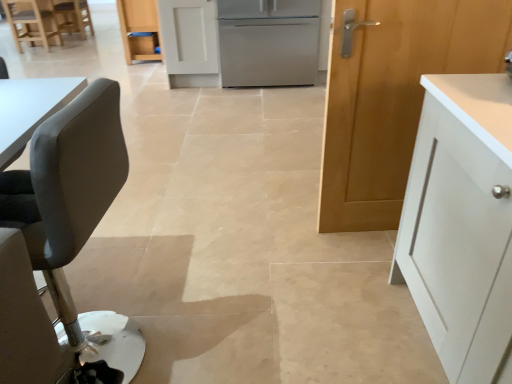
In order to face matte gray chair at left, marked as the 3th chair in a left-to-right arrangement, should I rotate leftwards or rightwards?

Rotate left and turn 25.815 degrees.

Measure the distance between matte gray chair at left, arranged as the third chair when viewed from the back, and camera.

matte gray chair at left, arranged as the third chair when viewed from the back, is 24.71 inches from camera.

Describe the element at coordinates (268, 42) in the screenshot. I see `stainless steel refrigerator at center` at that location.

I want to click on wooden door at right, which is the first cabinetry in right-to-left order, so 394,96.

Where is `matte wood cabinet at center, which is the 2th cabinetry from front to back`? This screenshot has height=384, width=512. matte wood cabinet at center, which is the 2th cabinetry from front to back is located at coordinates (139, 29).

From the picture: Measure the distance between matte gray chair at upper left, placed as the 1th chair when sorted from left to right, and camera.

A distance of 5.20 meters exists between matte gray chair at upper left, placed as the 1th chair when sorted from left to right, and camera.

At what (x,y) coordinates should I click in order to perform the action: click on matte gray chair at left, marked as the 3th chair in a left-to-right arrangement. Please return your answer as a coordinate pair (x, y). The width and height of the screenshot is (512, 384). Looking at the image, I should click on (65, 246).

Is wooden chair at upper left, the third chair when ordered from front to back, to the left or to the right of matte gray chair at upper left, the third chair when ordered from right to left, in the image?

wooden chair at upper left, the third chair when ordered from front to back, is to the right of matte gray chair at upper left, the third chair when ordered from right to left.

From a real-world perspective, is wooden chair at upper left, acting as the 2th chair starting from the right, on top of matte gray chair at upper left, positioned as the 2th chair in top-to-bottom order?

No.

In the scene shown: From the image's perspective, which is above, wooden chair at upper left, the second chair positioned from the left, or matte gray chair at upper left, which appears as the 2th chair when viewed from the back?

wooden chair at upper left, the second chair positioned from the left, is shown above in the image.

Which of these two, wooden chair at upper left, marked as the 3th chair in a bottom-to-top arrangement, or matte gray chair at upper left, marked as the second chair in a front-to-back arrangement, is thinner?

wooden chair at upper left, marked as the 3th chair in a bottom-to-top arrangement.

Is stainless steel refrigerator at center bigger than matte gray chair at upper left, marked as the second chair in a bottom-to-top arrangement?

Correct, stainless steel refrigerator at center is larger in size than matte gray chair at upper left, marked as the second chair in a bottom-to-top arrangement.

Would you say stainless steel refrigerator at center is outside matte gray chair at upper left, positioned as the 2th chair in top-to-bottom order?

Absolutely, stainless steel refrigerator at center is external to matte gray chair at upper left, positioned as the 2th chair in top-to-bottom order.

Considering their positions, is matte gray chair at left, arranged as the third chair when viewed from the back, located in front of or behind wooden door at right, which appears as the 2th cabinetry when viewed from the top?

matte gray chair at left, arranged as the third chair when viewed from the back, is positioned closer to the viewer than wooden door at right, which appears as the 2th cabinetry when viewed from the top.

Considering the sizes of objects matte gray chair at left, marked as the 3th chair in a left-to-right arrangement, and wooden door at right, placed as the first cabinetry when sorted from front to back, in the image provided, who is shorter, matte gray chair at left, marked as the 3th chair in a left-to-right arrangement, or wooden door at right, placed as the first cabinetry when sorted from front to back,?

matte gray chair at left, marked as the 3th chair in a left-to-right arrangement.

What's the angular difference between matte gray chair at left, arranged as the third chair when viewed from the back, and wooden door at right, which appears as the 2th cabinetry when viewed from the top,'s facing directions?

The angle between the facing direction of matte gray chair at left, arranged as the third chair when viewed from the back, and the facing direction of wooden door at right, which appears as the 2th cabinetry when viewed from the top, is 88.2 degrees.

Can you tell me how much wooden door at right, which ranks as the 2th cabinetry in back-to-front order, and matte gray chair at left, arranged as the third chair when viewed from the back, differ in facing direction?

88.2 degrees.

From a real-world perspective, who is located lower, wooden door at right, which ranks as the 2th cabinetry in back-to-front order, or matte gray chair at left, the third chair positioned from the top?

From a 3D spatial view, matte gray chair at left, the third chair positioned from the top, is below.

At what (x,y) coordinates should I click in order to perform the action: click on chair below the wooden door at right, which ranks as the 2th cabinetry in back-to-front order (from the image's perspective). Please return your answer as a coordinate pair (x, y). Looking at the image, I should click on (65, 246).

Is wooden door at right, the 2th cabinetry viewed from the left, shorter than matte gray chair at left, marked as the first chair in a front-to-back arrangement?

Incorrect, the height of wooden door at right, the 2th cabinetry viewed from the left, does not fall short of that of matte gray chair at left, marked as the first chair in a front-to-back arrangement.

Between stainless steel refrigerator at center and wooden chair at upper left, which appears as the 1th chair when viewed from the back, which one has smaller size?

Smaller between the two is wooden chair at upper left, which appears as the 1th chair when viewed from the back.

From the picture: Can you tell me how much stainless steel refrigerator at center and wooden chair at upper left, the third chair when ordered from front to back, differ in facing direction?

They differ by 89.3 degrees in their facing directions.

Does stainless steel refrigerator at center contain wooden chair at upper left, which appears as the 1th chair when viewed from the back?

No, wooden chair at upper left, which appears as the 1th chair when viewed from the back, is located outside of stainless steel refrigerator at center.

Considering the relative sizes of stainless steel refrigerator at center and wooden chair at upper left, marked as the 3th chair in a bottom-to-top arrangement, in the image provided, is stainless steel refrigerator at center wider than wooden chair at upper left, marked as the 3th chair in a bottom-to-top arrangement,?

Indeed, stainless steel refrigerator at center has a greater width compared to wooden chair at upper left, marked as the 3th chair in a bottom-to-top arrangement.

Between point (121, 15) and point (260, 18), which one is positioned behind?

Positioned behind is point (121, 15).

How far apart are matte wood cabinet at center, arranged as the 1th cabinetry when viewed from the top, and stainless steel refrigerator at center?

A distance of 2.01 meters exists between matte wood cabinet at center, arranged as the 1th cabinetry when viewed from the top, and stainless steel refrigerator at center.

Is matte wood cabinet at center, arranged as the 1th cabinetry when viewed from the top, facing away from stainless steel refrigerator at center?

No.

From their relative heights in the image, would you say matte wood cabinet at center, which appears as the 1th cabinetry when viewed from the back, is taller or shorter than stainless steel refrigerator at center?

matte wood cabinet at center, which appears as the 1th cabinetry when viewed from the back, is shorter than stainless steel refrigerator at center.

Is wooden door at right, which ranks as the 2th cabinetry in back-to-front order, taller or shorter than matte wood cabinet at center, which is the 2th cabinetry from front to back?

Considering their sizes, wooden door at right, which ranks as the 2th cabinetry in back-to-front order, has more height than matte wood cabinet at center, which is the 2th cabinetry from front to back.

How many degrees apart are the facing directions of wooden door at right, which ranks as the 2th cabinetry in back-to-front order, and matte wood cabinet at center, the second cabinetry in the bottom-to-top sequence?

The facing directions of wooden door at right, which ranks as the 2th cabinetry in back-to-front order, and matte wood cabinet at center, the second cabinetry in the bottom-to-top sequence, are 91.5 degrees apart.

How distant is wooden door at right, which appears as the 2th cabinetry when viewed from the top, from matte wood cabinet at center, the 1th cabinetry from the left?

A distance of 4.27 meters exists between wooden door at right, which appears as the 2th cabinetry when viewed from the top, and matte wood cabinet at center, the 1th cabinetry from the left.

From the image's perspective, is wooden door at right, placed as the first cabinetry when sorted from front to back, on top of matte wood cabinet at center, the second cabinetry in the bottom-to-top sequence?

No, from the image's perspective, wooden door at right, placed as the first cabinetry when sorted from front to back, is not over matte wood cabinet at center, the second cabinetry in the bottom-to-top sequence.

At what (x,y) coordinates should I click in order to perform the action: click on chair located above the matte gray chair at upper left, the third chair when ordered from right to left (from the image's perspective). Please return your answer as a coordinate pair (x, y). The height and width of the screenshot is (384, 512). Looking at the image, I should click on (73, 16).

The width and height of the screenshot is (512, 384). What are the coordinates of `the 1st chair below the stainless steel refrigerator at center (from a real-world perspective)` in the screenshot? It's located at (32, 22).

Based on their spatial positions, is wooden chair at upper left, the second chair positioned from the left, or stainless steel refrigerator at center further from matte gray chair at upper left, placed as the 1th chair when sorted from left to right?

stainless steel refrigerator at center is positioned further to the anchor matte gray chair at upper left, placed as the 1th chair when sorted from left to right.

Which object lies nearer to the anchor point matte gray chair at upper left, marked as the second chair in a front-to-back arrangement, stainless steel refrigerator at center or wooden door at right, which appears as the 2th cabinetry when viewed from the top?

stainless steel refrigerator at center is closer to matte gray chair at upper left, marked as the second chair in a front-to-back arrangement.

Looking at this image, estimate the real-world distances between objects in this image. Which object is further from wooden door at right, the first cabinetry when ordered from bottom to top, wooden chair at upper left, marked as the 3th chair in a bottom-to-top arrangement, or stainless steel refrigerator at center?

Based on the image, wooden chair at upper left, marked as the 3th chair in a bottom-to-top arrangement, appears to be further to wooden door at right, the first cabinetry when ordered from bottom to top.

When comparing their distances from wooden door at right, which appears as the 2th cabinetry when viewed from the top, does matte gray chair at upper left, the third chair when ordered from right to left, or stainless steel refrigerator at center seem further?

matte gray chair at upper left, the third chair when ordered from right to left, is positioned further to the anchor wooden door at right, which appears as the 2th cabinetry when viewed from the top.

Based on their spatial positions, is stainless steel refrigerator at center or matte gray chair at upper left, marked as the second chair in a front-to-back arrangement, further from wooden door at right, the first cabinetry when ordered from bottom to top?

matte gray chair at upper left, marked as the second chair in a front-to-back arrangement, lies further to wooden door at right, the first cabinetry when ordered from bottom to top, than the other object.

Which object lies nearer to the anchor point matte gray chair at left, arranged as the 1th chair when ordered from the bottom, wooden door at right, the 2th cabinetry viewed from the left, or matte gray chair at upper left, marked as the second chair in a bottom-to-top arrangement?

wooden door at right, the 2th cabinetry viewed from the left, is positioned closer to the anchor matte gray chair at left, arranged as the 1th chair when ordered from the bottom.

Consider the image. When comparing their distances from wooden door at right, the first cabinetry when ordered from bottom to top, does wooden chair at upper left, marked as the 3th chair in a bottom-to-top arrangement, or matte gray chair at upper left, placed as the 1th chair when sorted from left to right, seem further?

wooden chair at upper left, marked as the 3th chair in a bottom-to-top arrangement, lies further to wooden door at right, the first cabinetry when ordered from bottom to top, than the other object.

Considering their positions, is wooden chair at upper left, marked as the 3th chair in a bottom-to-top arrangement, positioned further to matte gray chair at upper left, the third chair when ordered from right to left, than matte wood cabinet at center, arranged as the 1th cabinetry when viewed from the top?

The object further to matte gray chair at upper left, the third chair when ordered from right to left, is matte wood cabinet at center, arranged as the 1th cabinetry when viewed from the top.

The image size is (512, 384). Find the location of `refrigerator between matte gray chair at left, arranged as the third chair when viewed from the back, and matte gray chair at upper left, the third chair when ordered from right to left, in the front-back direction`. refrigerator between matte gray chair at left, arranged as the third chair when viewed from the back, and matte gray chair at upper left, the third chair when ordered from right to left, in the front-back direction is located at coordinates (268, 42).

This screenshot has width=512, height=384. What are the coordinates of `cabinetry located between wooden door at right, which appears as the 2th cabinetry when viewed from the top, and wooden chair at upper left, the second chair positioned from the left, in the depth direction` in the screenshot? It's located at (139, 29).

The image size is (512, 384). Find the location of `chair between matte gray chair at left, the third chair positioned from the top, and wooden chair at upper left, which is the first chair in top-to-bottom order, from front to back`. chair between matte gray chair at left, the third chair positioned from the top, and wooden chair at upper left, which is the first chair in top-to-bottom order, from front to back is located at coordinates (32, 22).

Image resolution: width=512 pixels, height=384 pixels. What are the coordinates of `refrigerator between matte gray chair at upper left, marked as the second chair in a bottom-to-top arrangement, and wooden door at right, which is the first cabinetry in right-to-left order, from left to right` in the screenshot? It's located at (268, 42).